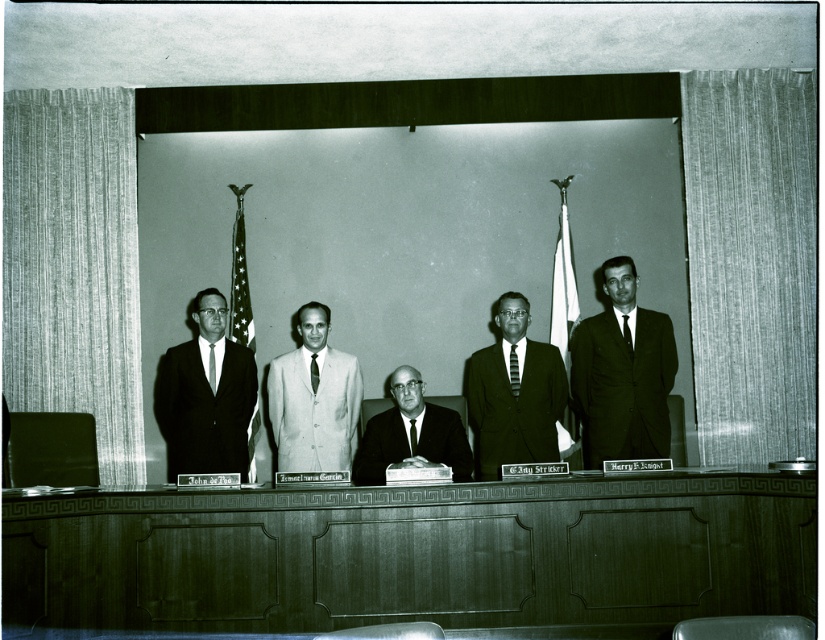
Question: Is dark suit at center positioned before black silk tie at center?

Choices:
 (A) yes
 (B) no

Answer: (A)

Question: Estimate the real-world distances between objects in this image. Which object is closer to the smooth black suit at center?

Choices:
 (A) dark wood table at center
 (B) light gray suit at center
 (C) red silk tie at center

Answer: (C)

Question: Is dark green suit at right below dark suit at center?

Choices:
 (A) no
 (B) yes

Answer: (A)

Question: Estimate the real-world distances between objects in this image. Which object is closer to the dark green suit at right?

Choices:
 (A) striped fabric tie at center
 (B) red silk tie at center
 (C) smooth black suit at center

Answer: (A)

Question: Does dark gray suit at center come behind striped fabric tie at center?

Choices:
 (A) no
 (B) yes

Answer: (A)

Question: Estimate the real-world distances between objects in this image. Which object is closer to the dark wood table at center?

Choices:
 (A) light gray suit at center
 (B) dark suit at center
 (C) dark green suit at right
 (D) striped fabric tie at center

Answer: (C)